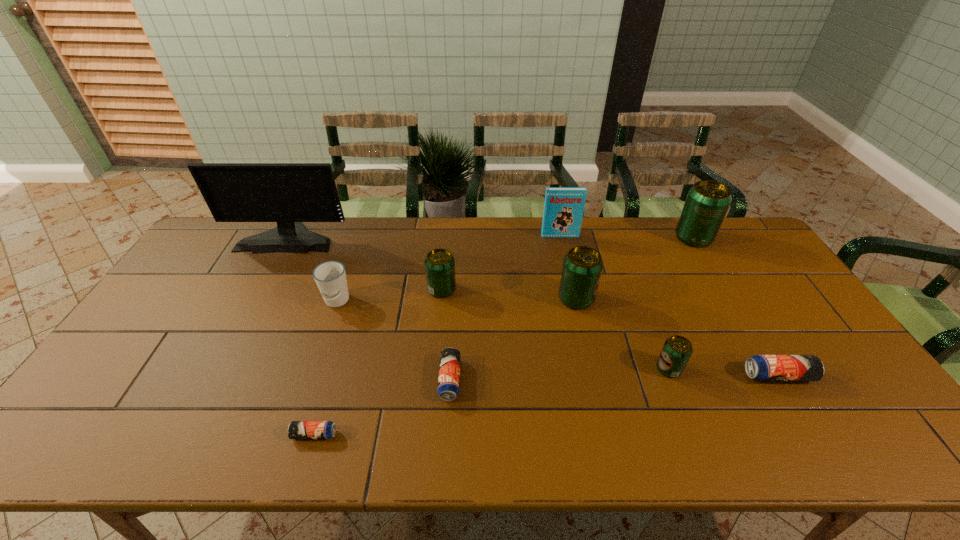
Where is `object located in the near edge section of the desktop`? The image size is (960, 540). object located in the near edge section of the desktop is located at coordinates (296, 429).

Where is `object positioned at the left edge`? object positioned at the left edge is located at coordinates (287, 193).

What are the coordinates of `object located at the far left corner` in the screenshot? It's located at (287, 193).

The image size is (960, 540). What are the coordinates of `object that is at the far right corner` in the screenshot? It's located at pos(707,202).

Where is `free space at the far edge`? The width and height of the screenshot is (960, 540). free space at the far edge is located at coordinates (488, 231).

Locate an element on the screen. The height and width of the screenshot is (540, 960). vacant space at the near edge is located at coordinates (492, 442).

I want to click on vacant space at the left edge, so click(x=204, y=287).

In the image, there is a desktop. Where is `vacant space at the right edge`? The height and width of the screenshot is (540, 960). vacant space at the right edge is located at coordinates (743, 282).

This screenshot has width=960, height=540. In order to click on free space at the far right corner of the desktop in this screenshot , I will do `click(728, 254)`.

Identify the location of free spot between the second shortest object and the second smallest green beer can. This screenshot has height=540, width=960. (445, 335).